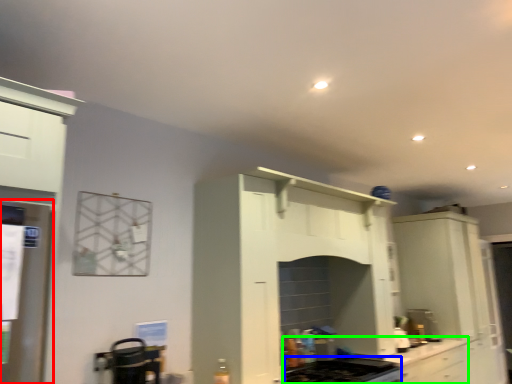
Question: Which is farther away from appliance (highlighted by a red box)? gas stove (highlighted by a blue box) or countertop (highlighted by a green box)?

Choices:
 (A) gas stove
 (B) countertop

Answer: (B)